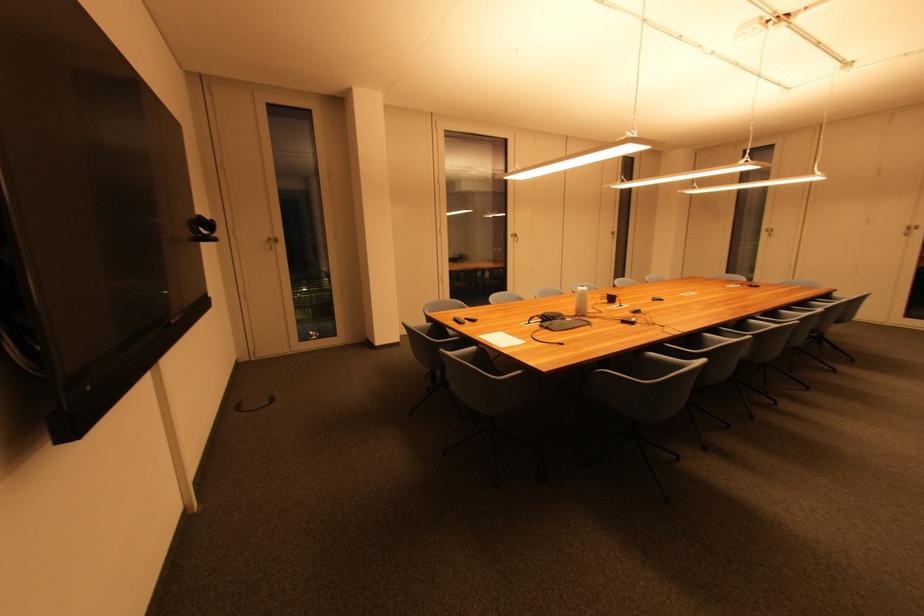
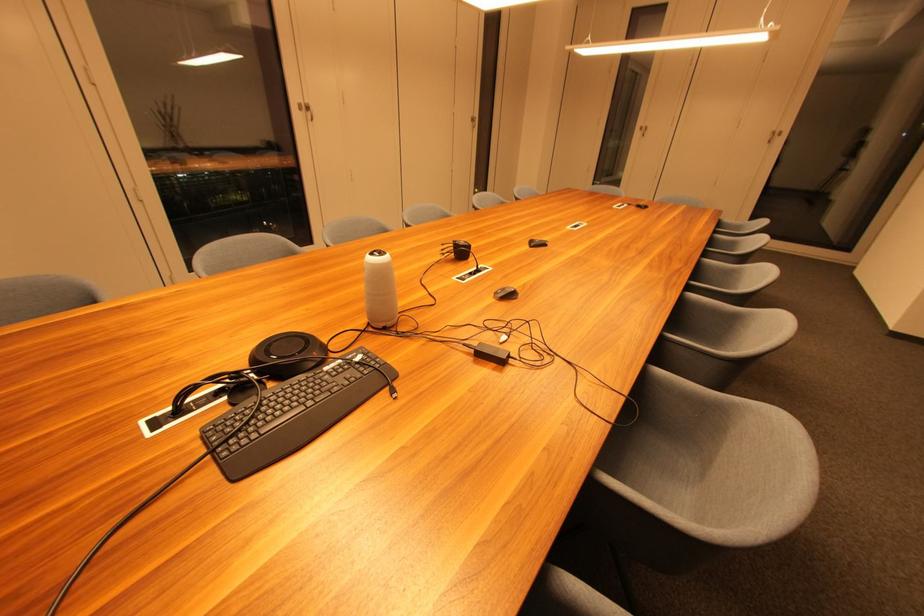
In a continuous first-person perspective shot, in which direction is the camera moving?

The cameraman walked toward right, forward.